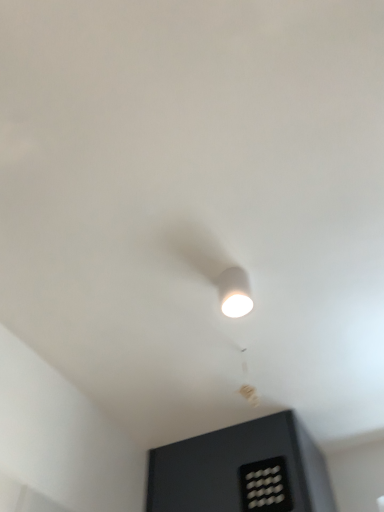
In order to face black plastic buttons at lower center, should I rotate leftwards or rightwards?

To face it directly, rotate right by 9.863 degrees.

Find the location of a particular element. black plastic buttons at lower center is located at coordinates (265, 486).

This screenshot has width=384, height=512. Describe the element at coordinates (265, 486) in the screenshot. I see `black plastic buttons at lower center` at that location.

Identify the location of black plastic buttons at lower center. This screenshot has height=512, width=384. (265, 486).